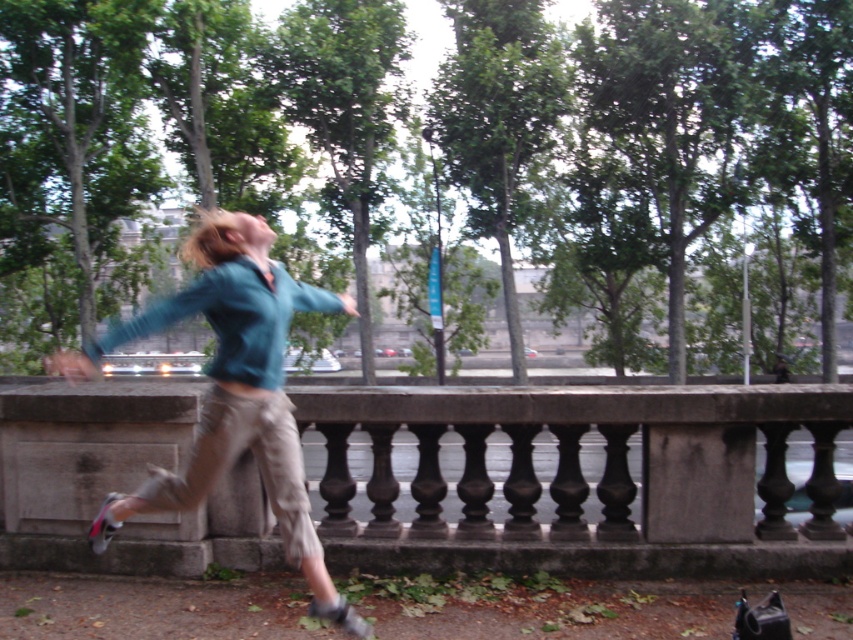
Is the position of smooth stone railing at center more distant than that of teal fabric shirt at center?

Yes.

Who is more distant from viewer, (524, 522) or (254, 380)?

The point (524, 522) is behind.

This screenshot has height=640, width=853. What do you see at coordinates (577, 477) in the screenshot?
I see `smooth stone railing at center` at bounding box center [577, 477].

The image size is (853, 640). What are the coordinates of `smooth stone railing at center` in the screenshot? It's located at (577, 477).